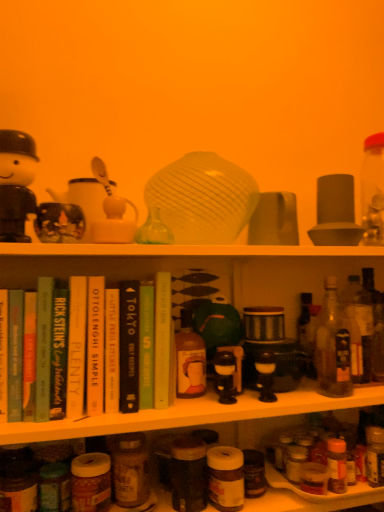
The image size is (384, 512). Find the location of `vacant region in front of hardcover book at center, which is counted as the first book, starting from the left`. vacant region in front of hardcover book at center, which is counted as the first book, starting from the left is located at coordinates (79, 423).